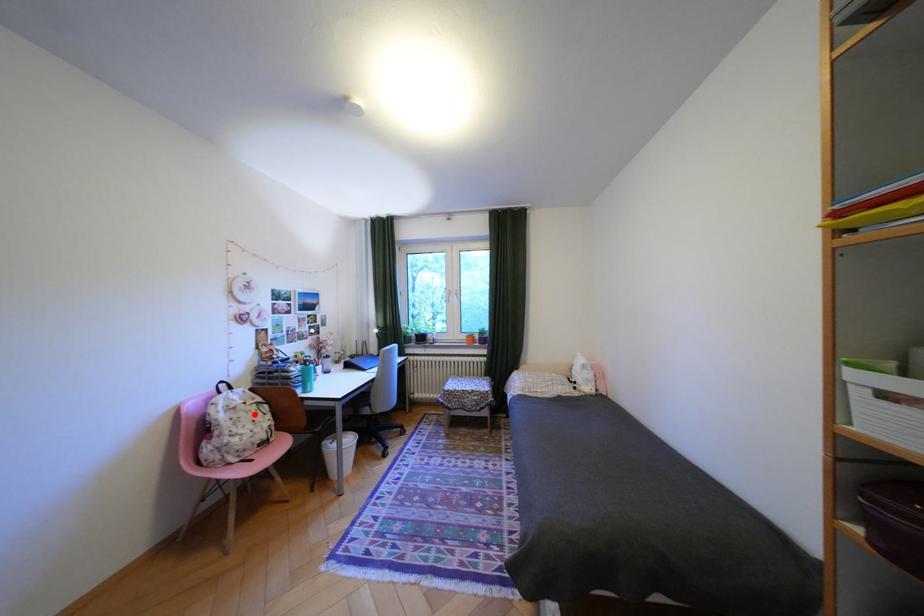
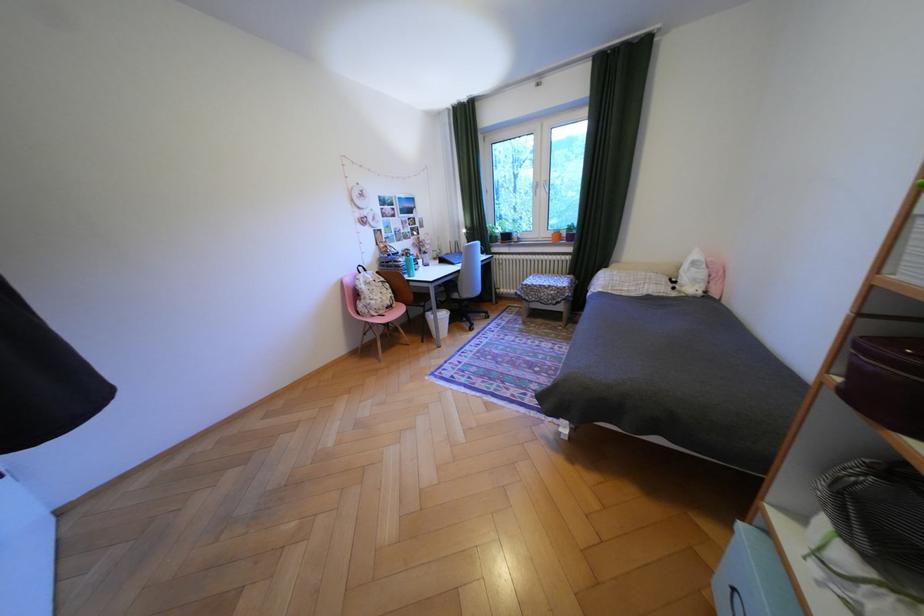
Question: I am providing you with two images of the same scene from different viewpoints. A red point is shown in image1. For the corresponding object point in image2, is it positioned nearer or farther from the camera?

Choices:
 (A) Nearer
 (B) Farther

Answer: (A)